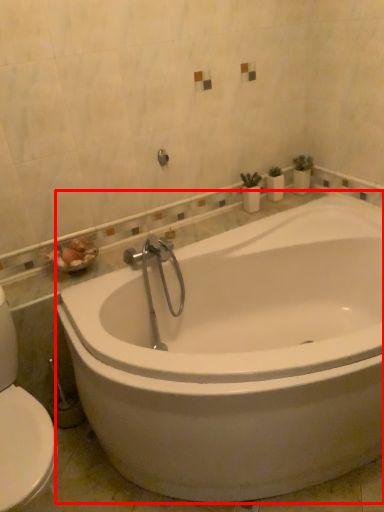
Question: Where is bathtub (annotated by the red box) located in relation to shower in the image?

Choices:
 (A) left
 (B) right

Answer: (B)